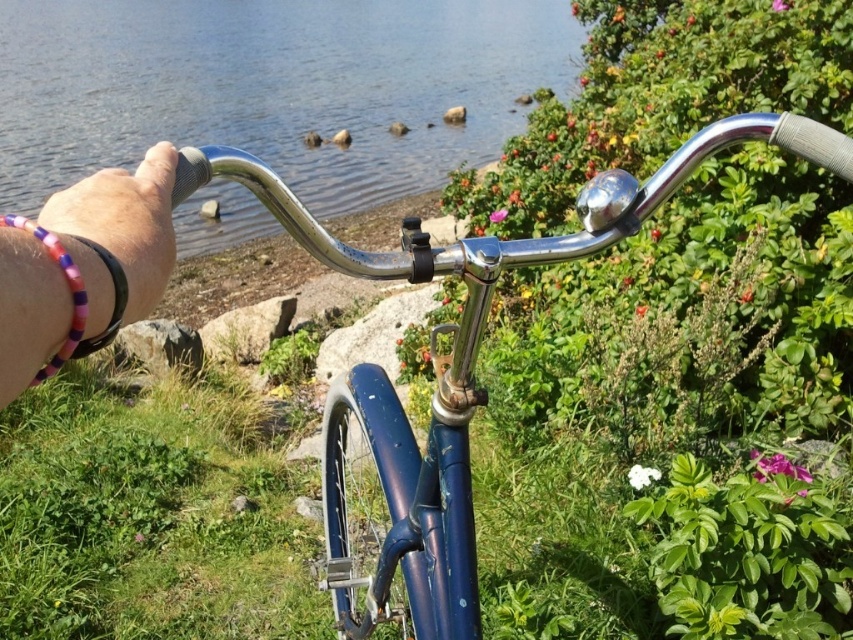
Question: Which point is farther to the camera?

Choices:
 (A) (74, 232)
 (B) (119, 323)

Answer: (A)

Question: From the image, what is the correct spatial relationship of purple beaded bracelet at lower left in relation to purple beaded bracelet at left?

Choices:
 (A) left
 (B) right

Answer: (A)

Question: Is shiny blue bicycle at center above purple beaded bracelet at lower left?

Choices:
 (A) no
 (B) yes

Answer: (A)

Question: Considering the real-world distances, which object is farthest from the shiny blue bicycle at center?

Choices:
 (A) multicolored beaded bracelet at left
 (B) purple beaded bracelet at lower left

Answer: (B)

Question: In this image, where is shiny blue bicycle at center located relative to multicolored beaded bracelet at left?

Choices:
 (A) left
 (B) right

Answer: (B)

Question: Which object is farther from the camera taking this photo?

Choices:
 (A) purple beaded bracelet at lower left
 (B) multicolored beaded bracelet at left
 (C) purple beaded bracelet at left
 (D) shiny blue bicycle at center

Answer: (D)